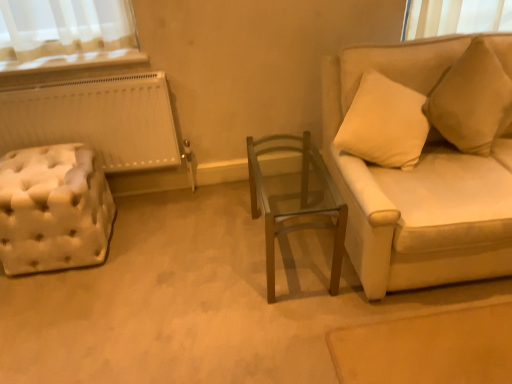
Question: In terms of height, does wooden glass table at center look taller or shorter compared to white tufted ottoman at left?

Choices:
 (A) tall
 (B) short

Answer: (A)

Question: In the image, is wooden glass table at center positioned in front of or behind white tufted ottoman at left?

Choices:
 (A) behind
 (B) front

Answer: (B)

Question: Which object is positioned closest to the wooden glass table at center?

Choices:
 (A) beige fabric couch at right
 (B) white tufted ottoman at left
 (C) beige fabric pillow at upper right

Answer: (A)

Question: Estimate the real-world distances between objects in this image. Which object is farther from the beige fabric pillow at upper right?

Choices:
 (A) beige fabric couch at right
 (B) white tufted ottoman at left
 (C) wooden glass table at center

Answer: (B)